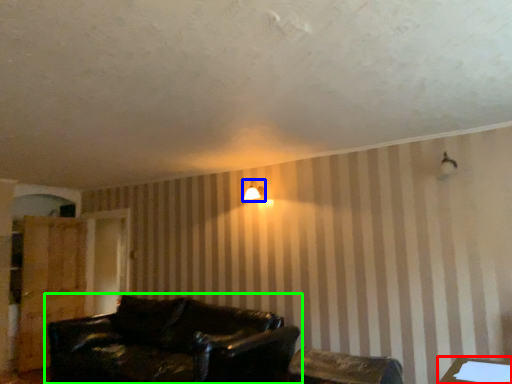
Question: Estimate the real-world distances between objects in this image. Which object is farther from table (highlighted by a red box), lamp (highlighted by a blue box) or studio couch (highlighted by a green box)?

Choices:
 (A) lamp
 (B) studio couch

Answer: (A)